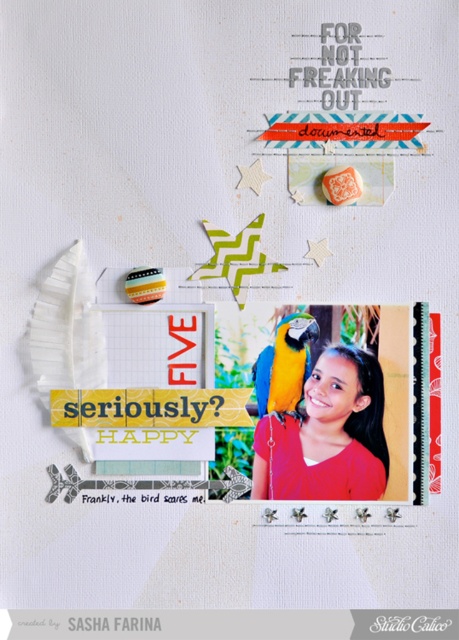
Consider the image. Does matte pink shirt at center have a larger size compared to blue/gold macaw at center?

Correct, matte pink shirt at center is larger in size than blue/gold macaw at center.

Can you confirm if matte pink shirt at center is positioned to the left of blue/gold macaw at center?

In fact, matte pink shirt at center is to the right of blue/gold macaw at center.

Who is more forward, (343, 477) or (292, 397)?

Point (343, 477)

At what (x,y) coordinates should I click in order to perform the action: click on matte pink shirt at center. Please return your answer as a coordinate pair (x, y). The image size is (459, 640). Looking at the image, I should click on (326, 435).